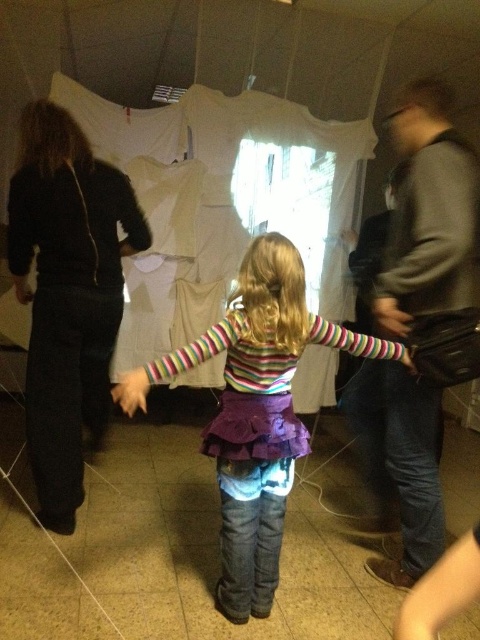
Does black fabric pants at left appear on the right side of smooth black hand at lower left?

Yes, black fabric pants at left is to the right of smooth black hand at lower left.

Does black fabric pants at left have a greater height compared to smooth black hand at lower left?

Correct, black fabric pants at left is much taller as smooth black hand at lower left.

Who is more forward, [46,116] or [21,300]?

Positioned in front is point [46,116].

Where is `black fabric pants at left`? This screenshot has height=640, width=480. black fabric pants at left is located at coordinates (68, 294).

Can you confirm if striped fabric at center is smaller than smooth leather handbag at lower right?

No.

Between point (218, 428) and point (408, 358), which one is positioned behind?

The point (408, 358) is behind.

Image resolution: width=480 pixels, height=640 pixels. In order to click on striped fabric at center in this screenshot , I will do `click(260, 413)`.

Is dark gray sweater at right thinner than smooth leather handbag at lower right?

Incorrect, dark gray sweater at right's width is not less than smooth leather handbag at lower right's.

Measure the distance between point (386, 506) and camera.

The distance of point (386, 506) from camera is 2.62 meters.

Who is more forward, (x=393, y=296) or (x=404, y=356)?

Point (x=393, y=296) is more forward.

The image size is (480, 640). What are the coordinates of `dark gray sweater at right` in the screenshot? It's located at (432, 209).